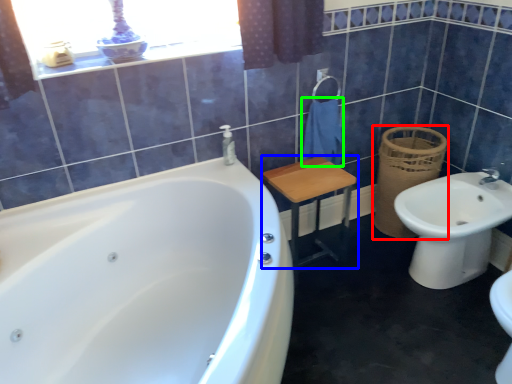
Question: Which object is the closest to the basket (highlighted by a red box)? Choose among these: furniture (highlighted by a blue box) or bath towel (highlighted by a green box).

Choices:
 (A) furniture
 (B) bath towel

Answer: (B)